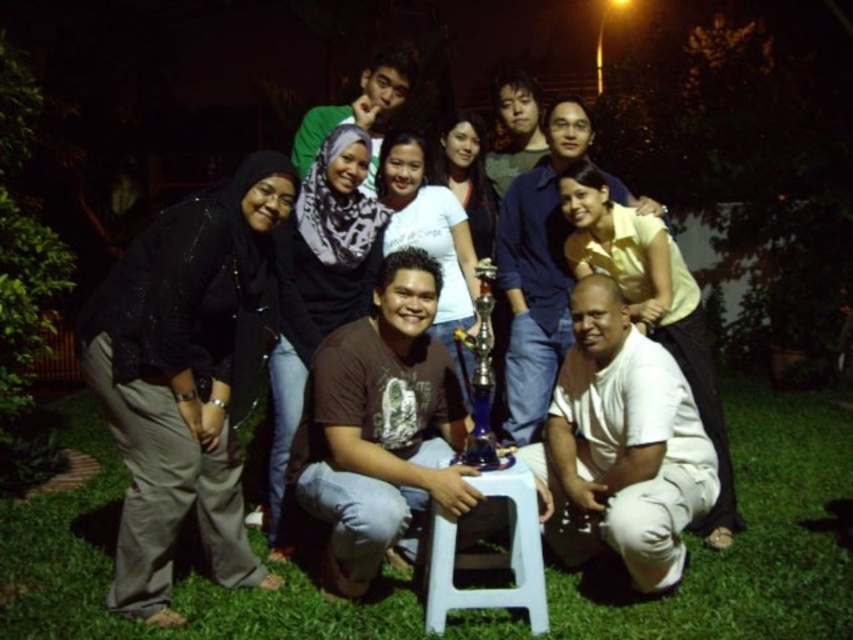
Question: Among these points, which one is farthest from the camera?

Choices:
 (A) (440, 538)
 (B) (735, 618)

Answer: (B)

Question: Which point is farther to the camera?

Choices:
 (A) (769, 531)
 (B) (463, 608)
 (C) (567, 406)
 (D) (169, 435)

Answer: (A)

Question: Observing the image, what is the correct spatial positioning of black matte pants at left in reference to white cotton shirt at lower right?

Choices:
 (A) below
 (B) above

Answer: (B)

Question: Is matte black shirt at center further to camera compared to black matte pants at left?

Choices:
 (A) no
 (B) yes

Answer: (B)

Question: Which point appears closest to the camera in this image?

Choices:
 (A) (77, 428)
 (B) (614, 307)
 (C) (196, 468)

Answer: (C)

Question: Observing the image, what is the correct spatial positioning of white cotton shirt at lower right in reference to white plastic stool at center?

Choices:
 (A) below
 (B) above

Answer: (B)